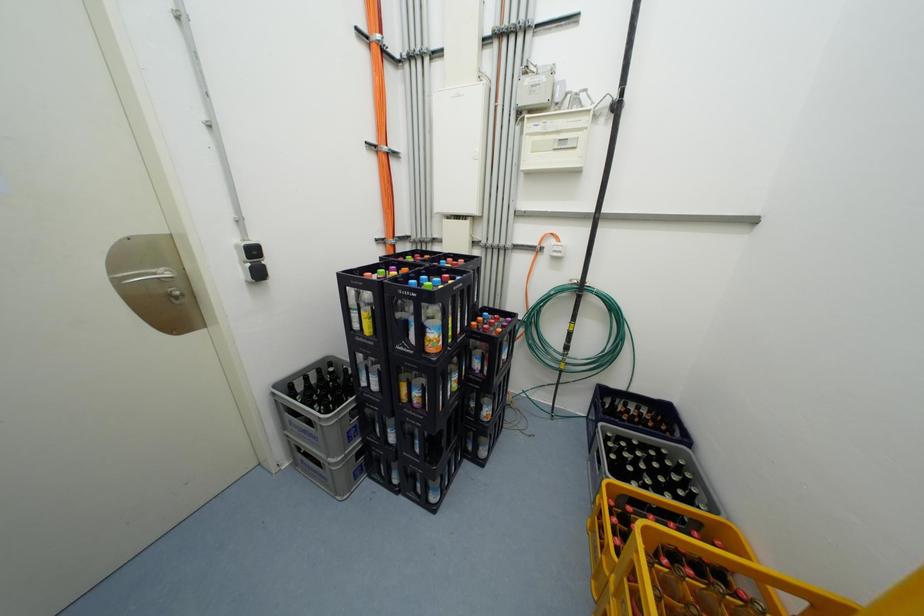
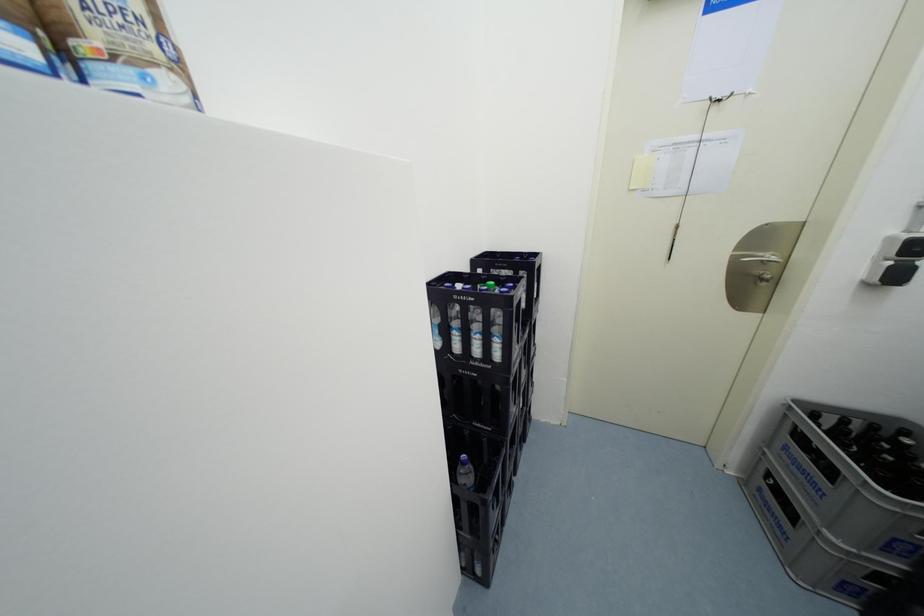
The first image is from the beginning of the video and the second image is from the end. How did the camera likely rotate when shooting the video?

The camera's rotation is toward left-down.